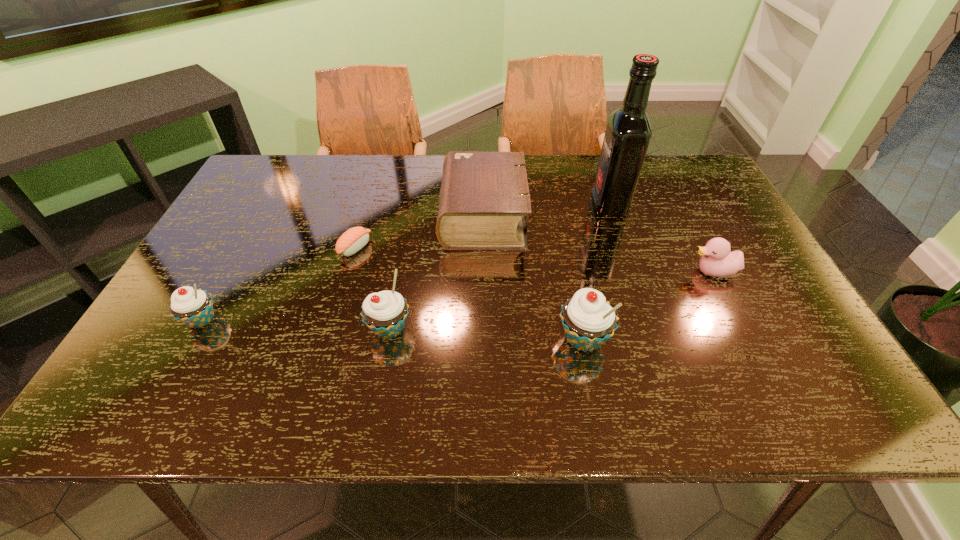
Where is `the fourth nearest object`? Image resolution: width=960 pixels, height=540 pixels. the fourth nearest object is located at coordinates (717, 260).

In order to click on the sixth tallest object in this screenshot , I will do `click(717, 260)`.

The width and height of the screenshot is (960, 540). I want to click on vacant position located on the back of the shortest cupcake, so click(230, 269).

You are a GUI agent. You are given a task and a screenshot of the screen. Output one action in this format:
    pyautogui.click(x=<x>, y=<y>)
    Task: Click on the free region located on the left of the fifth shortest object
    The height and width of the screenshot is (540, 960).
    Given the screenshot: What is the action you would take?
    pyautogui.click(x=313, y=329)

This screenshot has height=540, width=960. I want to click on vacant position located on the back of the third object from right to left, so click(571, 280).

The width and height of the screenshot is (960, 540). What are the coordinates of `vacant area located on the front-facing side of the liquor` in the screenshot? It's located at (571, 205).

I want to click on vacant space located 0.290m on the front-facing side of the liquor, so click(494, 205).

Image resolution: width=960 pixels, height=540 pixels. What are the coordinates of `free spot located 0.310m on the front-facing side of the liquor` in the screenshot? It's located at (488, 205).

The height and width of the screenshot is (540, 960). I want to click on blank space located on the spine side of the Bible, so click(420, 216).

At what (x,y) coordinates should I click in order to perform the action: click on free space located 0.150m on the spine side of the Bible. Please return your answer as a coordinate pair (x, y). The height and width of the screenshot is (540, 960). Looking at the image, I should click on pyautogui.click(x=389, y=216).